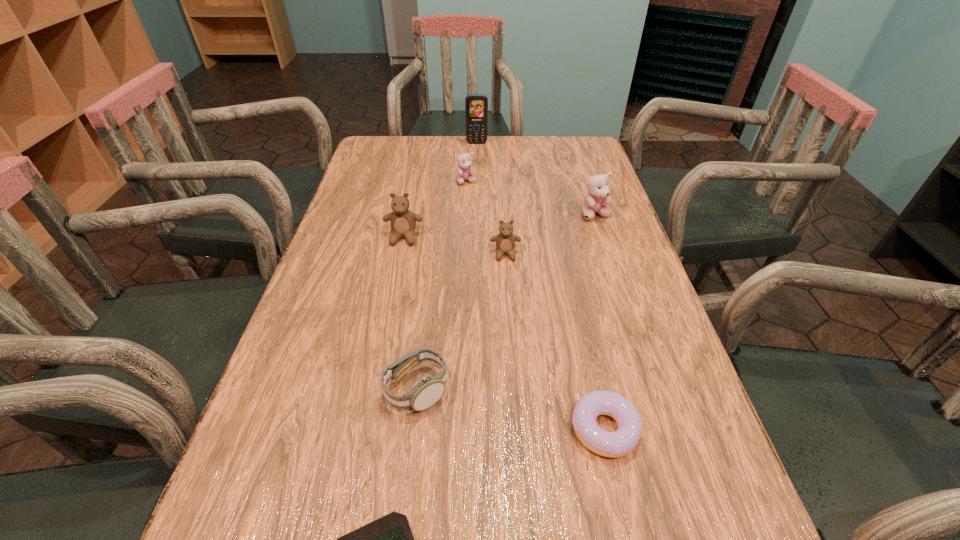
Locate an element on the screen. The image size is (960, 540). vacant space located on the left of the second object from right to left is located at coordinates (331, 429).

At what (x,y) coordinates should I click in order to perform the action: click on object situated at the far edge. Please return your answer as a coordinate pair (x, y). Looking at the image, I should click on (476, 105).

In order to click on object situated at the left edge in this screenshot , I will do 403,222.

Find the location of a particular element. This screenshot has width=960, height=540. teddy bear at the right edge is located at coordinates (598, 192).

Image resolution: width=960 pixels, height=540 pixels. I want to click on doughnut that is at the right edge, so 613,444.

Locate an element on the screen. The width and height of the screenshot is (960, 540). vacant region at the far edge of the desktop is located at coordinates (518, 168).

In the image, there is a desktop. In order to click on vacant space at the left edge in this screenshot , I will do `click(345, 278)`.

Locate an element on the screen. Image resolution: width=960 pixels, height=540 pixels. blank area at the right edge is located at coordinates (576, 232).

This screenshot has height=540, width=960. In the image, there is a desktop. In order to click on free region at the far right corner in this screenshot , I will do coord(577,151).

Where is `vacant area between the white watch and the leftmost teddy bear`? vacant area between the white watch and the leftmost teddy bear is located at coordinates (410, 314).